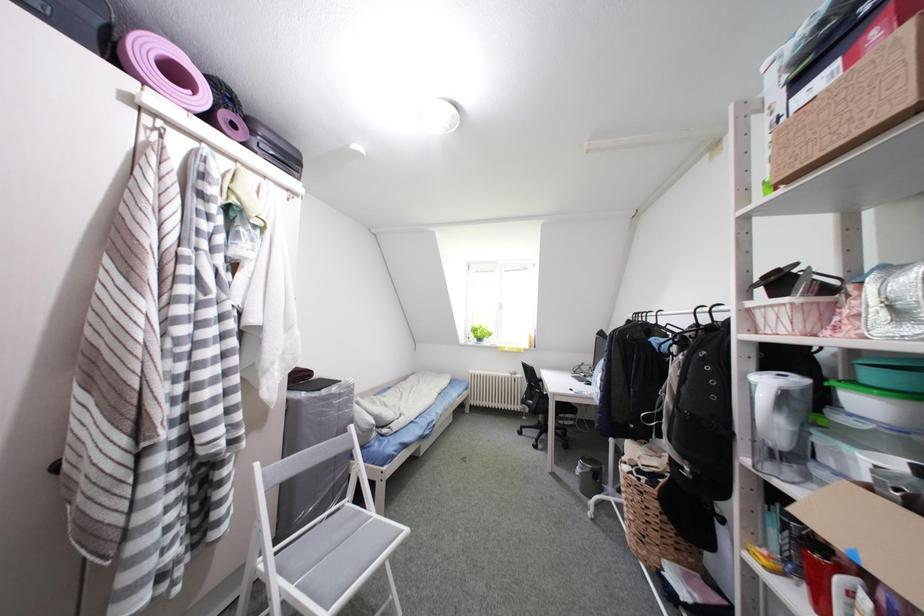
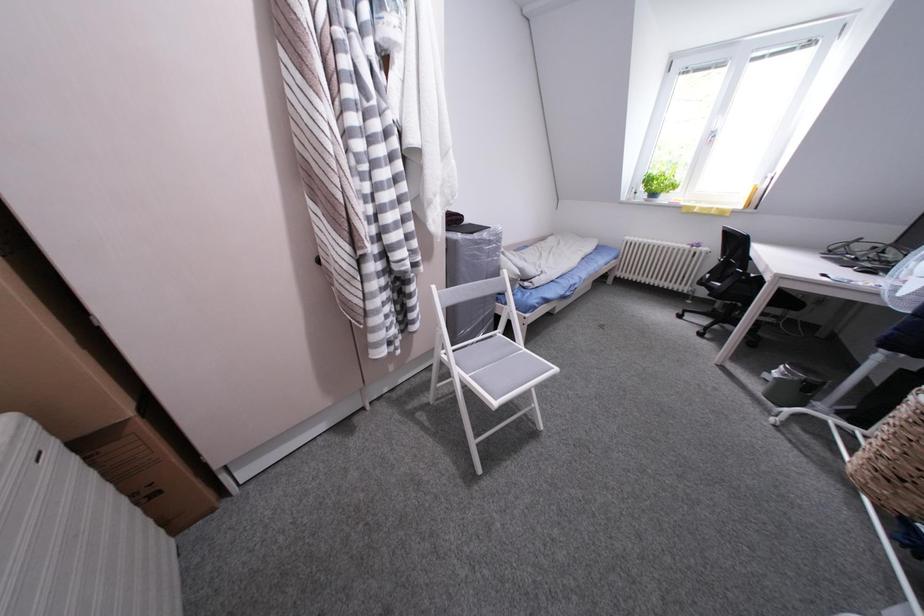
The images are taken continuously from a first-person perspective. In which direction is your viewpoint rotating?

The camera's rotation is toward left-down.